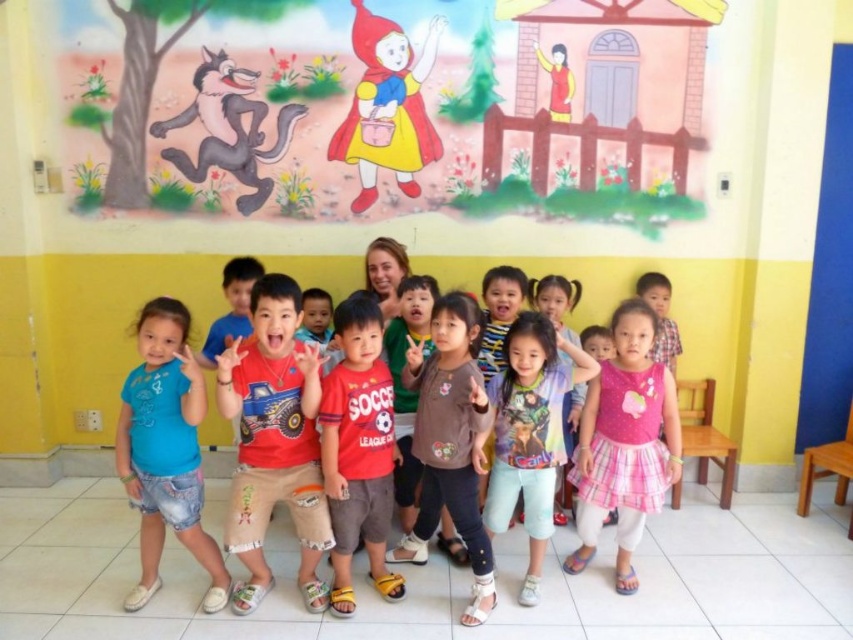
Question: Where is red cotton shirt at center located in relation to brown cotton shirt at center in the image?

Choices:
 (A) left
 (B) right

Answer: (A)

Question: Which is nearer to the reddish-orange cotton t-shirt at center?

Choices:
 (A) pink plaid dress at center
 (B) reddish-orange t-shirt at center

Answer: (B)

Question: Among these objects, which one is farthest from the camera?

Choices:
 (A) pink plaid dress at center
 (B) reddish-orange cotton t-shirt at center

Answer: (A)

Question: Which point is farther to the camera?

Choices:
 (A) (595, 396)
 (B) (555, 371)

Answer: (A)

Question: Considering the relative positions of blue denim shorts at lower left and multicolored printed shirt at center in the image provided, where is blue denim shorts at lower left located with respect to multicolored printed shirt at center?

Choices:
 (A) left
 (B) right

Answer: (A)

Question: Does pink plaid dress at center appear on the right side of multicolored printed shirt at center?

Choices:
 (A) yes
 (B) no

Answer: (A)